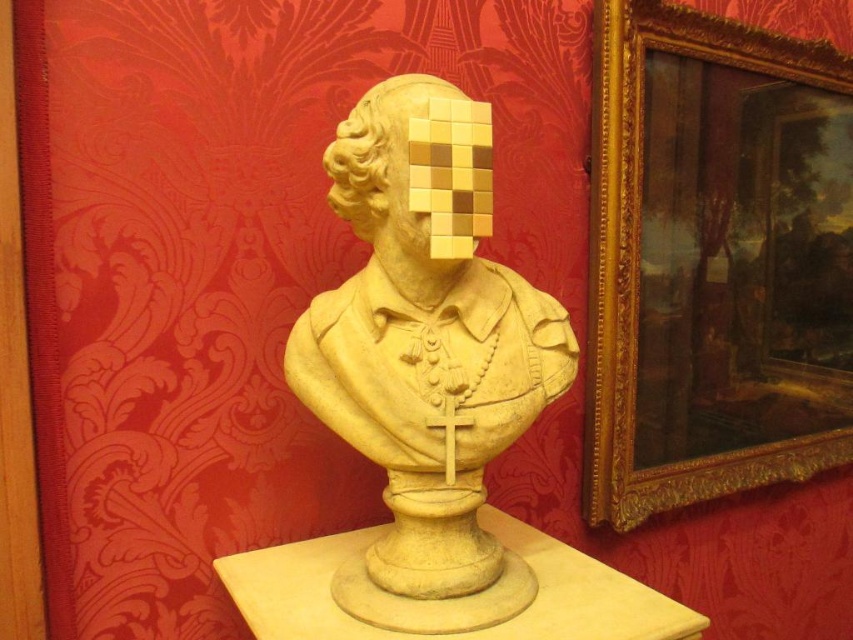
You are an art conservator standing in front of the classical bust sculpture. You notice two points marked in the scene. Which point is closer to you, point (695,16) or point (392,81)?

Point (392,81) is closer to you because it is in front of point (695,16).

Looking at this image, you are an art conservator assessing the placement of the gold ornate frame at upper right and the matte stone bust at center in a museum display. Considering their heights, which object would require a taller stand or base to ensure stability?

The gold ornate frame at upper right has a greater height compared to the matte stone bust at center, so it would require a taller stand or base to ensure stability.